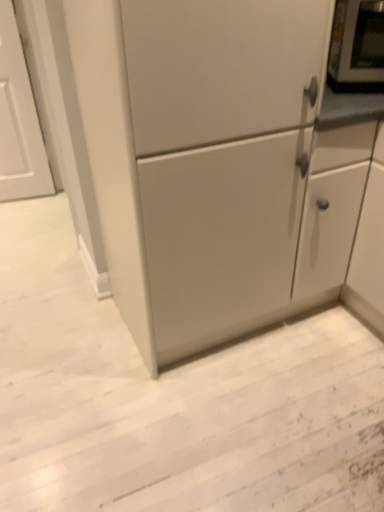
Question: Is point (382, 78) closer or farther from the camera than point (309, 148)?

Choices:
 (A) farther
 (B) closer

Answer: (A)

Question: Is metallic silver microwave at upper right in front of or behind matte white cabinet at center in the image?

Choices:
 (A) behind
 (B) front

Answer: (A)

Question: Do you think metallic silver microwave at upper right is within matte white cabinet at center, or outside of it?

Choices:
 (A) inside
 (B) outside

Answer: (B)

Question: From their relative heights in the image, would you say matte white cabinet at center is taller or shorter than metallic silver microwave at upper right?

Choices:
 (A) tall
 (B) short

Answer: (A)

Question: Is matte white cabinet at center inside or outside of metallic silver microwave at upper right?

Choices:
 (A) inside
 (B) outside

Answer: (B)

Question: In terms of width, does matte white cabinet at center look wider or thinner when compared to metallic silver microwave at upper right?

Choices:
 (A) thin
 (B) wide

Answer: (B)

Question: From a real-world perspective, is matte white cabinet at center physically located above or below metallic silver microwave at upper right?

Choices:
 (A) below
 (B) above

Answer: (A)